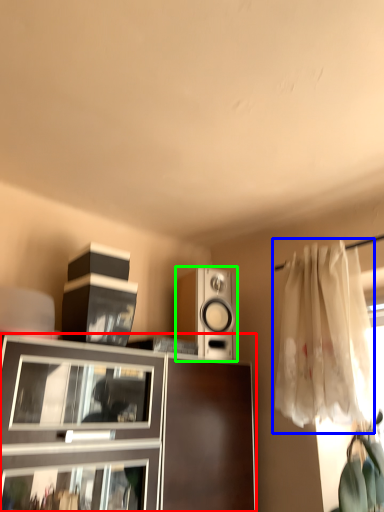
Question: Which object is the farthest from cabinetry (highlighted by a red box)? Choose among these: curtain (highlighted by a blue box) or loudspeaker (highlighted by a green box).

Choices:
 (A) curtain
 (B) loudspeaker

Answer: (A)